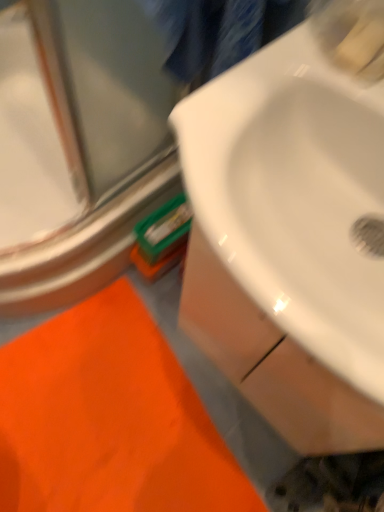
Question: From a real-world perspective, is clear glass door at upper left positioned above or below orange fabric bath mat at lower left?

Choices:
 (A) below
 (B) above

Answer: (B)

Question: Considering the positions of point (107, 112) and point (193, 436), is point (107, 112) closer or farther from the camera than point (193, 436)?

Choices:
 (A) closer
 (B) farther

Answer: (A)

Question: Which object is the farthest from the white glossy sink at center?

Choices:
 (A) clear glass door at upper left
 (B) orange fabric bath mat at lower left

Answer: (B)

Question: Estimate the real-world distances between objects in this image. Which object is farther from the white glossy sink at center?

Choices:
 (A) clear glass door at upper left
 (B) orange fabric bath mat at lower left

Answer: (B)